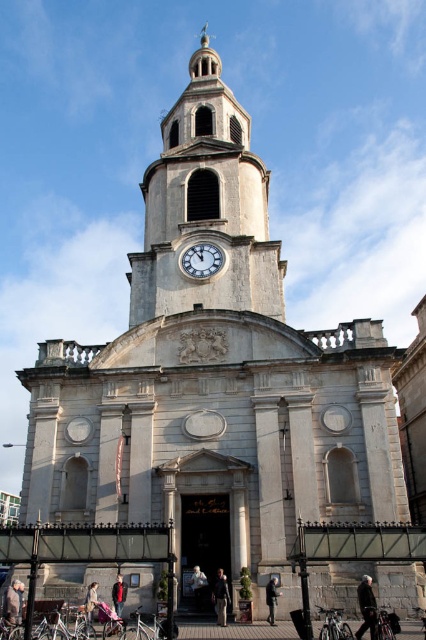
You are a tourist standing in front of the grand historic church. You see the white stone clock tower at center and the dark gray jacket at lower right. Which object is closer to you?

The dark gray jacket at lower right is behind the white stone clock tower at center, so the white stone clock tower at center is closer to you.

You are standing in front of the historic church and notice the matte silver clock at upper center and the denim jacket at lower left. Which object is shorter in height?

The matte silver clock at upper center is not as tall as the denim jacket at lower left, so the matte silver clock at upper center is shorter in height.

You are standing in front of the historic church and notice the matte silver clock at upper center and the denim jacket at lower left. Which object is located higher up in the image?

The matte silver clock at upper center is positioned over the denim jacket at lower left, so it is higher up in the image.